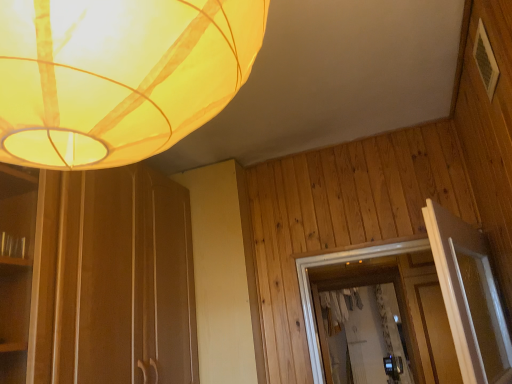
Question: Could you tell me if white textured frame at upper right is facing translucent yellow fabric lampshade at upper left?

Choices:
 (A) no
 (B) yes

Answer: (A)

Question: Does white textured frame at upper right lie in front of translucent yellow fabric lampshade at upper left?

Choices:
 (A) no
 (B) yes

Answer: (A)

Question: Is white textured frame at upper right oriented away from translucent yellow fabric lampshade at upper left?

Choices:
 (A) yes
 (B) no

Answer: (B)

Question: Does white textured frame at upper right appear on the left side of translucent yellow fabric lampshade at upper left?

Choices:
 (A) no
 (B) yes

Answer: (A)

Question: Is white textured frame at upper right far from translucent yellow fabric lampshade at upper left?

Choices:
 (A) no
 (B) yes

Answer: (B)

Question: Is translucent yellow fabric lampshade at upper left completely or partially inside white textured frame at upper right?

Choices:
 (A) yes
 (B) no

Answer: (B)

Question: Can we say translucent yellow fabric lampshade at upper left lies outside white textured frame at upper right?

Choices:
 (A) yes
 (B) no

Answer: (A)

Question: Is white textured frame at upper right at the back of translucent yellow fabric lampshade at upper left?

Choices:
 (A) yes
 (B) no

Answer: (B)

Question: Is translucent yellow fabric lampshade at upper left next to white textured frame at upper right and touching it?

Choices:
 (A) no
 (B) yes

Answer: (A)

Question: Is translucent yellow fabric lampshade at upper left facing towards white textured frame at upper right?

Choices:
 (A) yes
 (B) no

Answer: (B)

Question: Considering the relative sizes of translucent yellow fabric lampshade at upper left and white textured frame at upper right in the image provided, is translucent yellow fabric lampshade at upper left thinner than white textured frame at upper right?

Choices:
 (A) yes
 (B) no

Answer: (B)

Question: From the image's perspective, is translucent yellow fabric lampshade at upper left beneath white textured frame at upper right?

Choices:
 (A) no
 (B) yes

Answer: (B)

Question: Would you say white textured frame at upper right is to the left or to the right of translucent yellow fabric lampshade at upper left in the picture?

Choices:
 (A) right
 (B) left

Answer: (A)